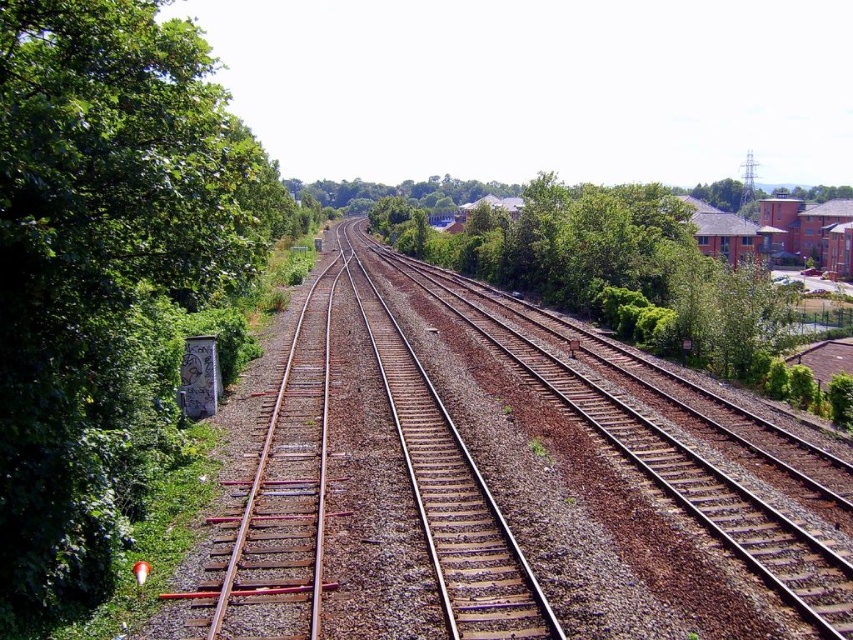
The width and height of the screenshot is (853, 640). Describe the element at coordinates (482, 483) in the screenshot. I see `brown gravel track at center` at that location.

Does point (316, 385) come behind point (479, 243)?

That is False.

Find the location of `brown gravel track at center`. brown gravel track at center is located at coordinates (482, 483).

The width and height of the screenshot is (853, 640). I want to click on brown gravel track at center, so click(482, 483).

Is point (74, 259) closer to camera compared to point (643, 296)?

Yes.

Is point (74, 243) farther from viewer compared to point (619, 266)?

No, (74, 243) is in front of (619, 266).

Where is `green leafy tree at left`? The width and height of the screenshot is (853, 640). green leafy tree at left is located at coordinates (103, 272).

Does brown gravel track at center have a greater height compared to green leafy tree at left?

Incorrect, brown gravel track at center's height is not larger of green leafy tree at left's.

Between brown gravel track at center and green leafy tree at left, which one has less height?

brown gravel track at center

Is point (734, 465) in front of point (86, 340)?

That is False.

The image size is (853, 640). In order to click on brown gravel track at center in this screenshot , I will do coord(482,483).